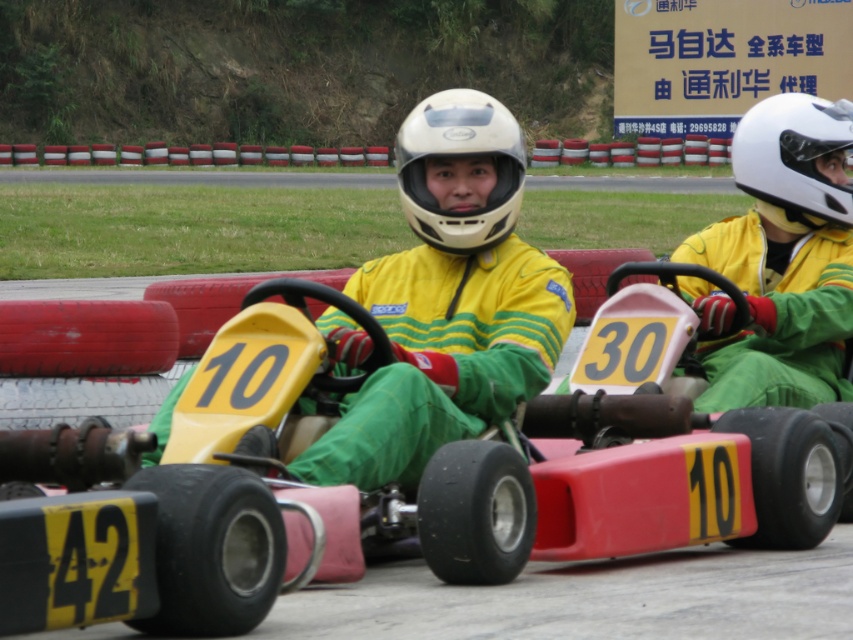
Question: Can you confirm if matte yellow/green racing suit at center is bigger than yellow/green fabric suit at center?

Choices:
 (A) no
 (B) yes

Answer: (B)

Question: Observing the image, what is the correct spatial positioning of yellow matte race car at center in reference to matte yellow/green racing suit at center?

Choices:
 (A) below
 (B) above

Answer: (A)

Question: Does matte white helmet at center have a larger size compared to white matte helmet at upper right?

Choices:
 (A) yes
 (B) no

Answer: (B)

Question: Among these points, which one is farthest from the camera?

Choices:
 (A) (824, 400)
 (B) (743, 120)

Answer: (B)

Question: Which point appears farthest from the camera in this image?

Choices:
 (A) (436, 211)
 (B) (456, 396)
 (C) (115, 458)

Answer: (A)

Question: Which point is farther to the camera?

Choices:
 (A) (354, 566)
 (B) (503, 134)
 (C) (729, 275)
 (D) (756, 115)

Answer: (D)